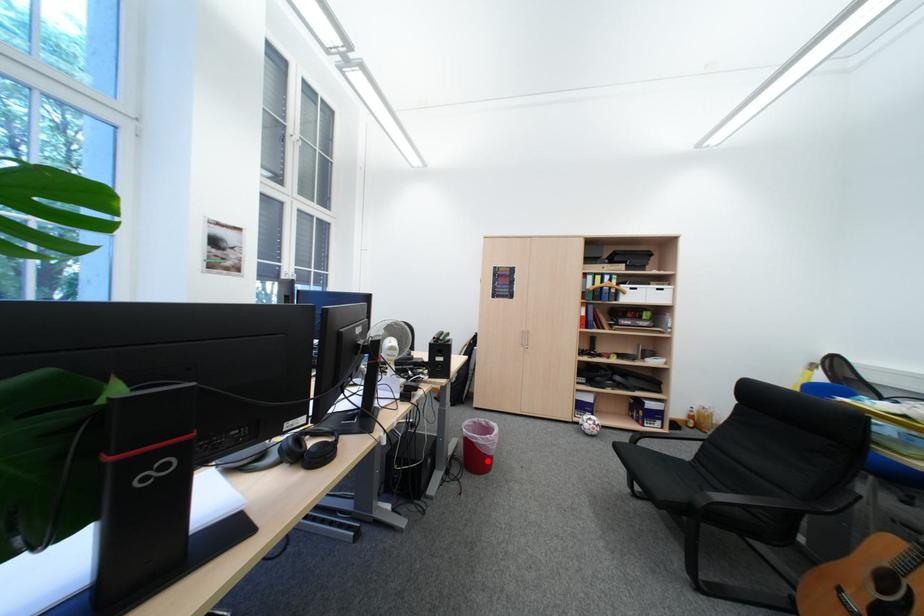
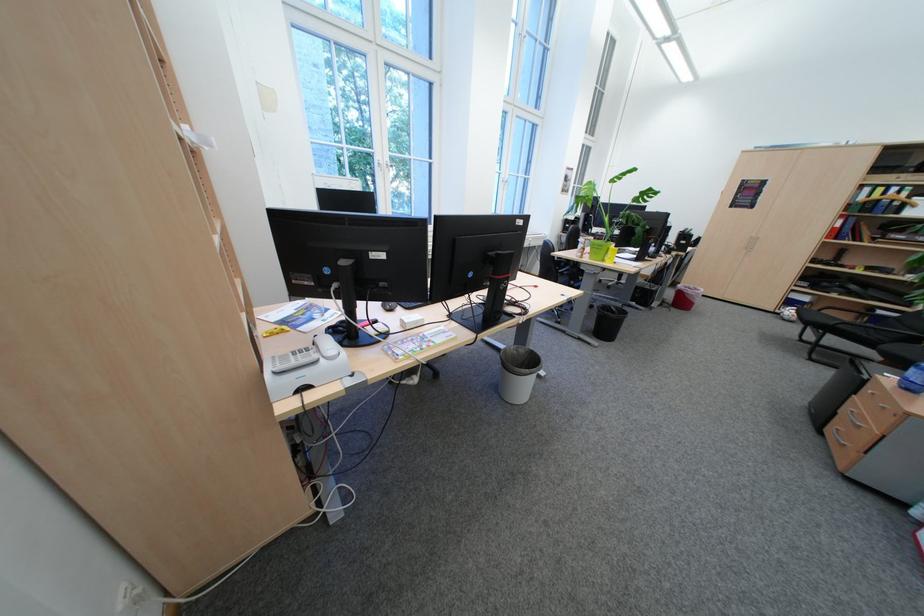
The point at the highlighted location is marked in the first image. Where is the corresponding point in the second image?

(694, 302)